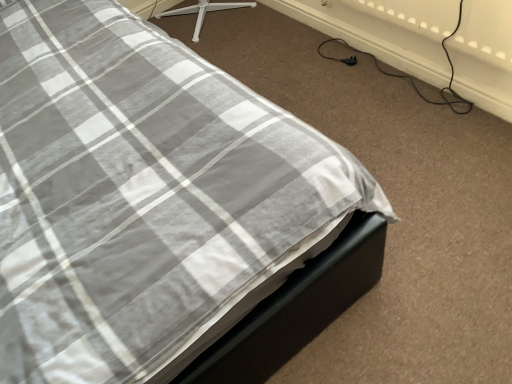
I want to click on free area behind black plastic plug at lower right, so (333, 47).